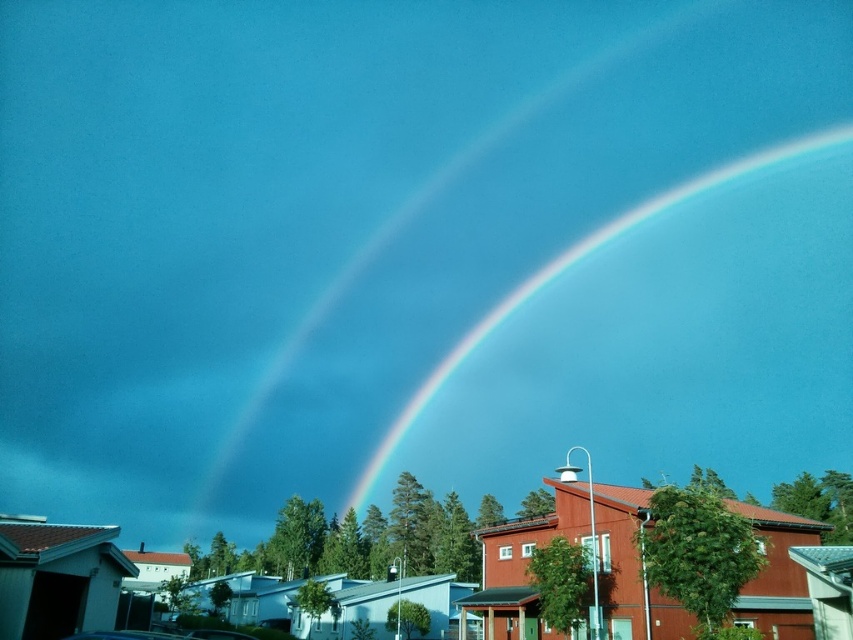
Between rainbow at upper center and metallic silver car at lower center, which one is positioned higher?

rainbow at upper center is higher up.

Which is behind, point (421, 396) or point (212, 630)?

Positioned behind is point (421, 396).

Who is more forward, [496,314] or [199,628]?

Point [199,628] is in front.

Identify the location of rainbow at upper center. The width and height of the screenshot is (853, 640). pos(566,269).